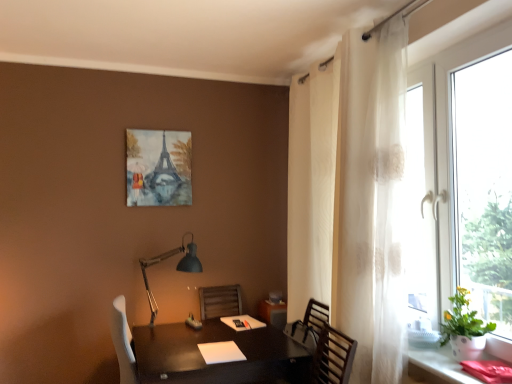
Question: From the image's perspective, is transparent glass window at right on top of green leafy plant at right?

Choices:
 (A) no
 (B) yes

Answer: (B)

Question: Is transparent glass window at right oriented towards green leafy plant at right?

Choices:
 (A) yes
 (B) no

Answer: (A)

Question: Is transparent glass window at right surrounding green leafy plant at right?

Choices:
 (A) no
 (B) yes

Answer: (B)

Question: Considering the relative sizes of transparent glass window at right and green leafy plant at right in the image provided, is transparent glass window at right taller than green leafy plant at right?

Choices:
 (A) no
 (B) yes

Answer: (B)

Question: Is transparent glass window at right bigger than green leafy plant at right?

Choices:
 (A) no
 (B) yes

Answer: (B)

Question: From a real-world perspective, is transparent glass window at right below green leafy plant at right?

Choices:
 (A) yes
 (B) no

Answer: (B)

Question: Is matte black desk at lower right not inside watercolor paper painting of eiffel tower at upper center?

Choices:
 (A) no
 (B) yes

Answer: (B)

Question: Is matte black desk at lower right to the right of watercolor paper painting of eiffel tower at upper center from the viewer's perspective?

Choices:
 (A) yes
 (B) no

Answer: (A)

Question: Is matte black desk at lower right taller than watercolor paper painting of eiffel tower at upper center?

Choices:
 (A) yes
 (B) no

Answer: (B)

Question: From a real-world perspective, is matte black desk at lower right located higher than watercolor paper painting of eiffel tower at upper center?

Choices:
 (A) no
 (B) yes

Answer: (A)

Question: From the image's perspective, is matte black desk at lower right on top of watercolor paper painting of eiffel tower at upper center?

Choices:
 (A) no
 (B) yes

Answer: (A)

Question: Is matte black desk at lower right wider than watercolor paper painting of eiffel tower at upper center?

Choices:
 (A) no
 (B) yes

Answer: (B)

Question: Considering the relative sizes of watercolor paper painting of eiffel tower at upper center and white sheer curtain at right in the image provided, is watercolor paper painting of eiffel tower at upper center thinner than white sheer curtain at right?

Choices:
 (A) yes
 (B) no

Answer: (A)